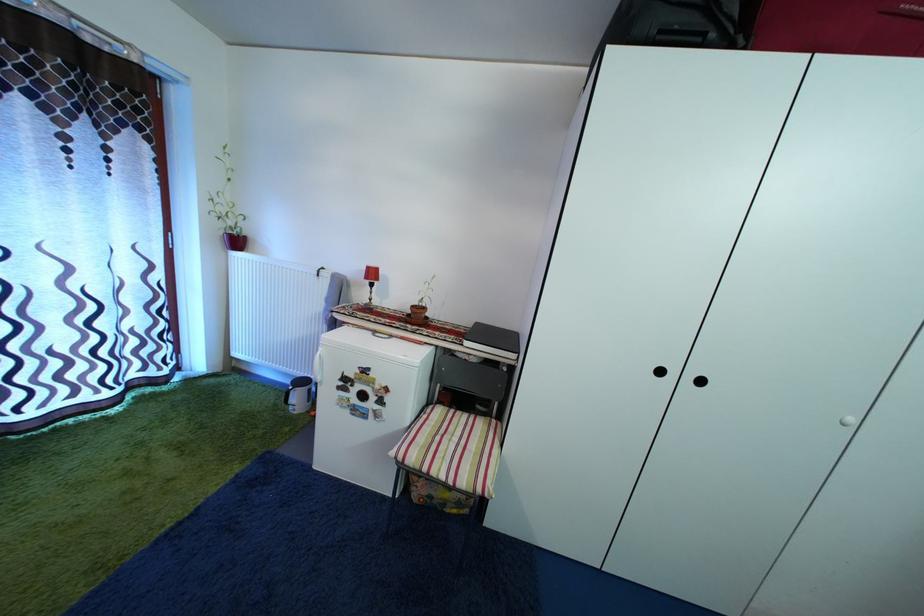
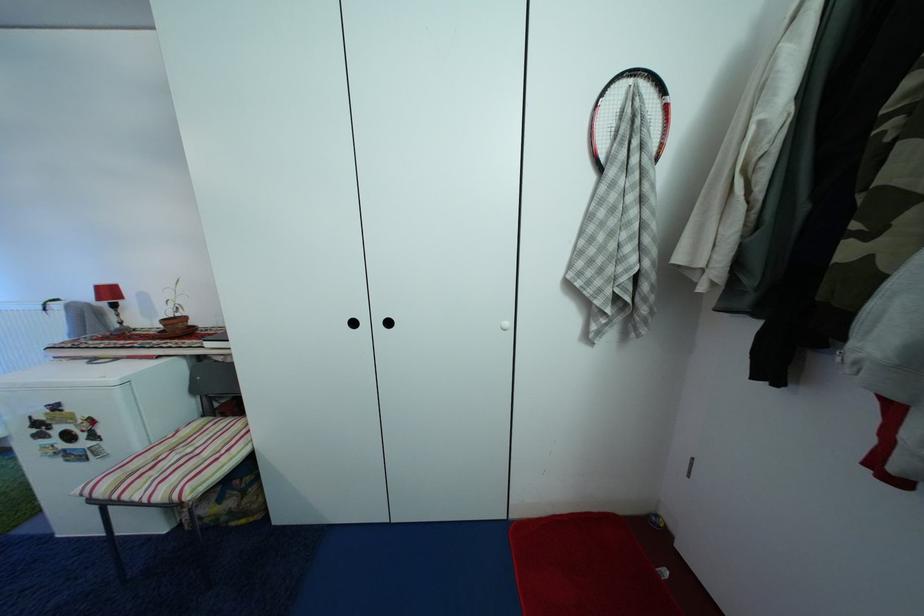
Locate, in the second image, the point that corresponds to (x=377, y=276) in the first image.

(106, 294)